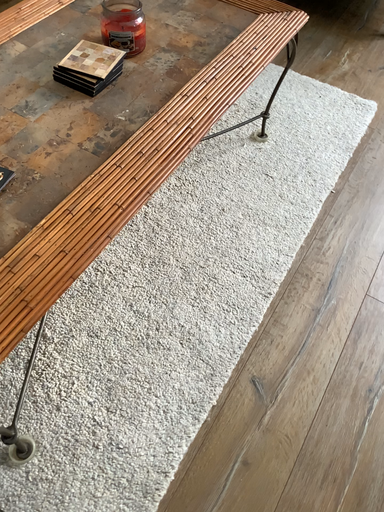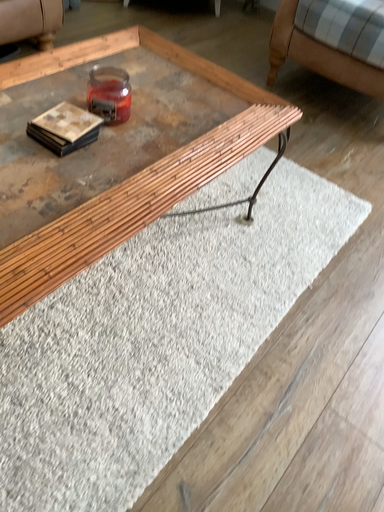
Question: Which way did the camera rotate in the video?

Choices:
 (A) rotated downward
 (B) rotated upward

Answer: (B)